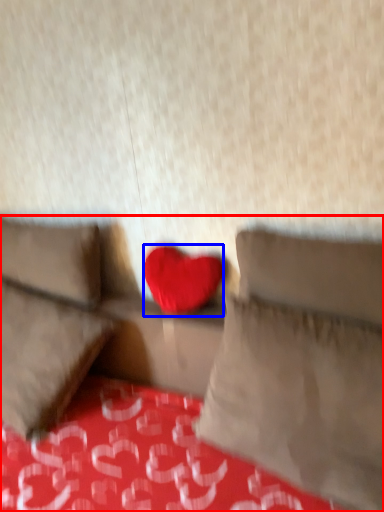
Question: Which point is further to the camera, studio couch (highlighted by a red box) or heart (highlighted by a blue box)?

Choices:
 (A) studio couch
 (B) heart

Answer: (B)